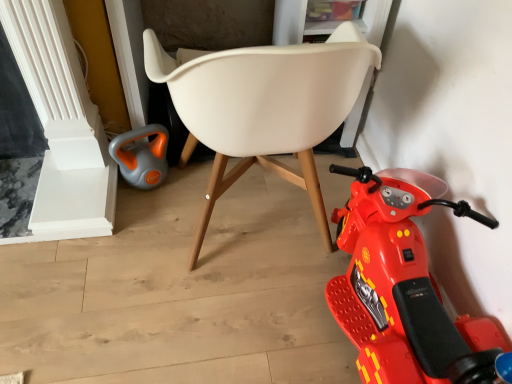
Question: From the image's perspective, is gray-orange plastic kettle at lower left beneath white plastic chair at center?

Choices:
 (A) no
 (B) yes

Answer: (B)

Question: Is gray-orange plastic kettle at lower left positioned in front of white plastic chair at center?

Choices:
 (A) yes
 (B) no

Answer: (B)

Question: Does gray-orange plastic kettle at lower left have a greater width compared to white plastic chair at center?

Choices:
 (A) no
 (B) yes

Answer: (A)

Question: From a real-world perspective, is gray-orange plastic kettle at lower left over white plastic chair at center?

Choices:
 (A) yes
 (B) no

Answer: (B)

Question: From the image's perspective, is gray-orange plastic kettle at lower left above white plastic chair at center?

Choices:
 (A) no
 (B) yes

Answer: (A)

Question: Is the position of gray-orange plastic kettle at lower left more distant than that of white plastic chair at center?

Choices:
 (A) no
 (B) yes

Answer: (B)

Question: Does gray-orange plastic kettle at lower left have a lesser height compared to shiny plastic scooter at lower right?

Choices:
 (A) no
 (B) yes

Answer: (B)

Question: Is gray-orange plastic kettle at lower left in contact with shiny plastic scooter at lower right?

Choices:
 (A) yes
 (B) no

Answer: (B)

Question: From the image's perspective, is gray-orange plastic kettle at lower left above shiny plastic scooter at lower right?

Choices:
 (A) no
 (B) yes

Answer: (B)

Question: Does gray-orange plastic kettle at lower left have a greater height compared to shiny plastic scooter at lower right?

Choices:
 (A) no
 (B) yes

Answer: (A)

Question: Is gray-orange plastic kettle at lower left to the left of shiny plastic scooter at lower right from the viewer's perspective?

Choices:
 (A) yes
 (B) no

Answer: (A)

Question: Considering the relative positions of gray-orange plastic kettle at lower left and shiny plastic scooter at lower right in the image provided, is gray-orange plastic kettle at lower left in front of shiny plastic scooter at lower right?

Choices:
 (A) no
 (B) yes

Answer: (A)

Question: Does white plastic chair at center come behind shiny plastic scooter at lower right?

Choices:
 (A) yes
 (B) no

Answer: (B)